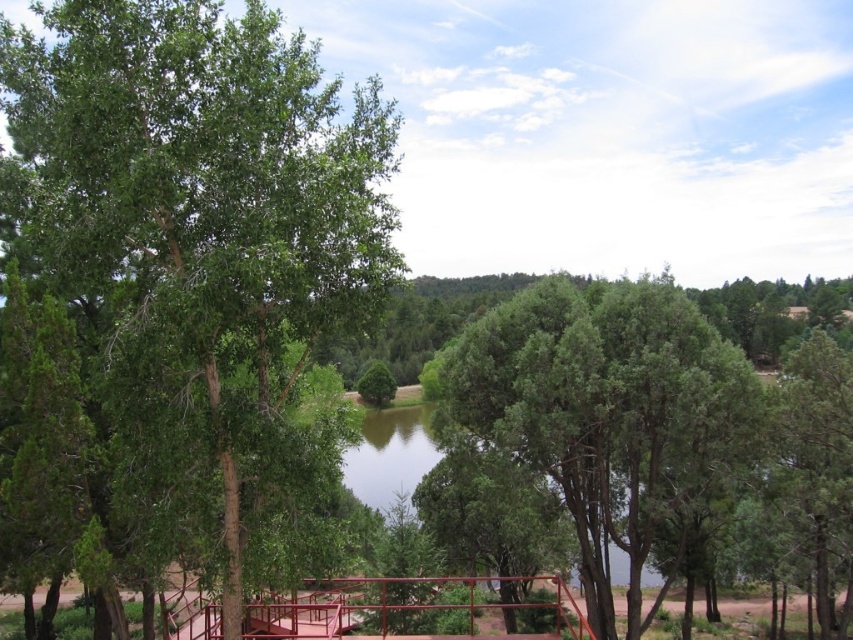
Question: Is green leafy tree at left bigger than green textured tree at center?

Choices:
 (A) no
 (B) yes

Answer: (A)

Question: Which of the following is the closest to the observer?

Choices:
 (A) green leafy tree at left
 (B) green textured tree at center

Answer: (A)

Question: Which of the following is the closest to the observer?

Choices:
 (A) green textured tree at center
 (B) green leafy tree at left

Answer: (B)

Question: Does green leafy tree at left appear on the right side of green textured tree at center?

Choices:
 (A) no
 (B) yes

Answer: (A)

Question: Is green leafy tree at left to the right of green textured tree at center from the viewer's perspective?

Choices:
 (A) yes
 (B) no

Answer: (B)

Question: Which point appears closest to the camera in this image?

Choices:
 (A) (115, 83)
 (B) (636, 330)

Answer: (A)